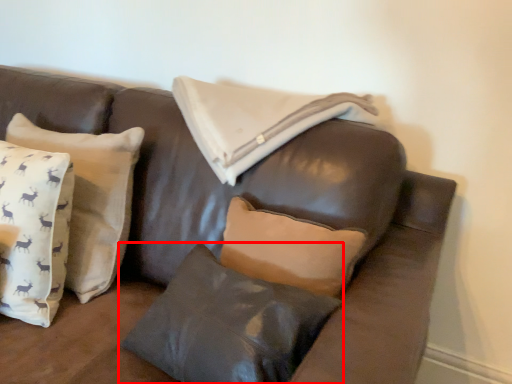
Question: In this image, where is pillow (annotated by the red box) located relative to pillow?

Choices:
 (A) right
 (B) left

Answer: (A)